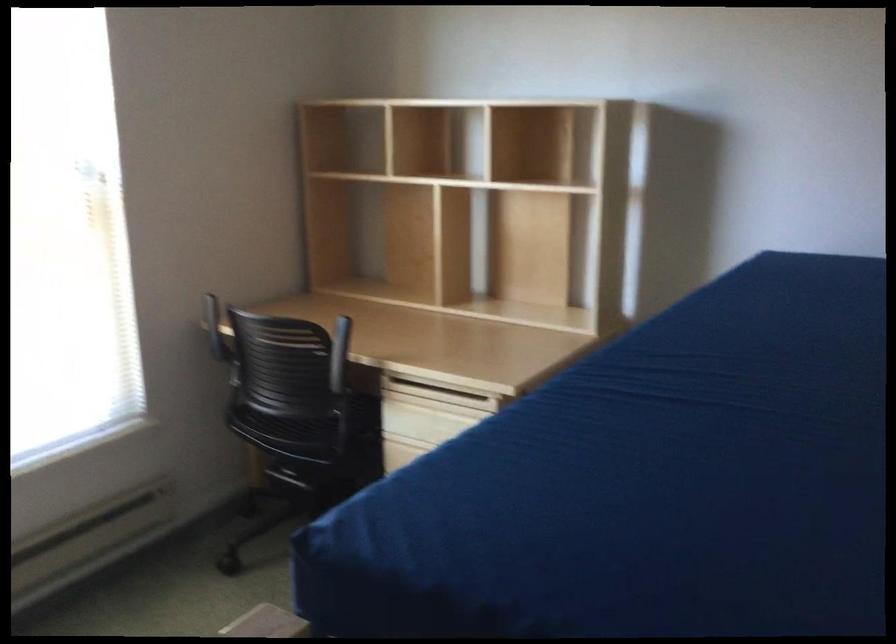
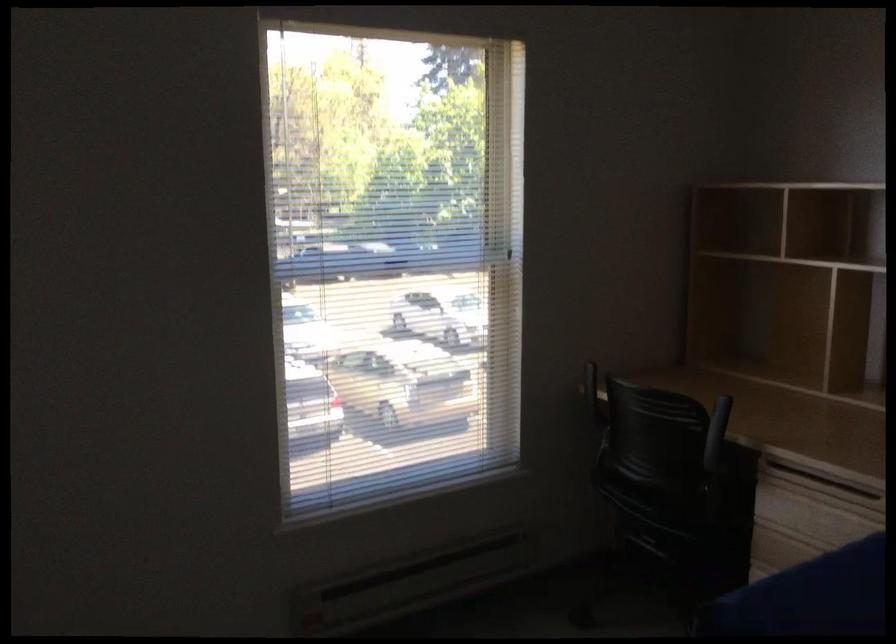
Question: The camera is either moving clockwise (left) or counter-clockwise (right) around the object. The first image is from the beginning of the video and the second image is from the end. Is the camera moving left or right when shooting the video?

Choices:
 (A) Left
 (B) Right

Answer: (B)